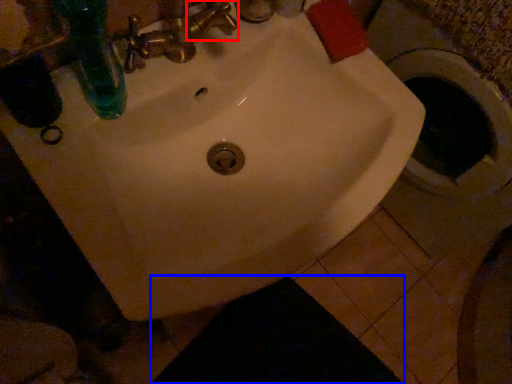
Question: Which point is closer to the camera, plumbing fixture (highlighted by a red box) or dark (highlighted by a blue box)?

Choices:
 (A) plumbing fixture
 (B) dark

Answer: (A)